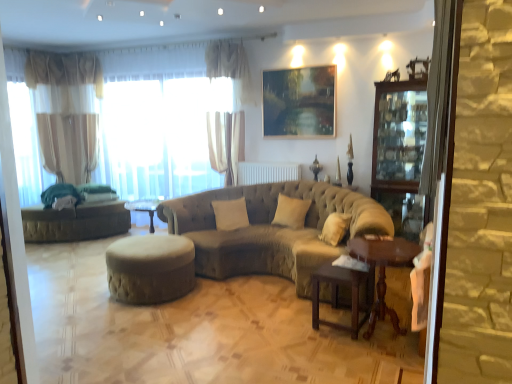
Question: From the image's perspective, is translucent fabric at left above or below brown wooden table at lower right, which is the 2th table from right to left?

Choices:
 (A) below
 (B) above

Answer: (B)

Question: Based on their sizes in the image, would you say translucent fabric at left is bigger or smaller than brown wooden table at lower right, the 1th table positioned from the left?

Choices:
 (A) big
 (B) small

Answer: (A)

Question: Estimate the real-world distances between objects in this image. Which object is closer to the translucent fabric at left?

Choices:
 (A) velvet beige stool at center
 (B) sheer fabric curtain at upper center, positioned as the first curtain in right-to-left order
 (C) beige fabric pillow at center, arranged as the 2th pillow when viewed from the left
 (D) white plastic radiator at center
 (E) brown wooden table at lower right, the 1th table positioned from the left

Answer: (B)

Question: Based on their relative distances, which object is nearer to the white plastic radiator at center?

Choices:
 (A) transparent glass cabinet at right
 (B) velvet beige stool at center
 (C) brown wooden table at lower right, which is the 2th table from right to left
 (D) translucent fabric at left
 (E) metallic painting at upper center

Answer: (E)